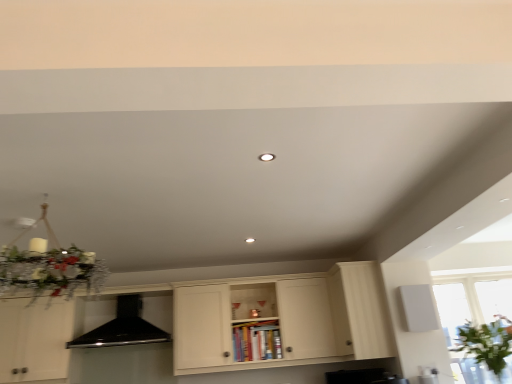
Question: From a real-world perspective, is matte white cabinet at center, the 2th cabinetry when ordered from right to left, physically located above or below black matte exhaust hood at center?

Choices:
 (A) above
 (B) below

Answer: (B)

Question: Is matte white cabinet at center, positioned as the 1th cabinetry in left-to-right order, taller or shorter than black matte exhaust hood at center?

Choices:
 (A) short
 (B) tall

Answer: (B)

Question: Estimate the real-world distances between objects in this image. Which object is closer to the transparent glass window at lower right?

Choices:
 (A) white wood cabinet at right, the second cabinetry positioned from the left
 (B) matte white cabinet at center, the 2th cabinetry when ordered from right to left
 (C) black matte exhaust hood at center

Answer: (A)

Question: Estimate the real-world distances between objects in this image. Which object is closer to the white wood cabinet at right, the second cabinetry positioned from the left?

Choices:
 (A) transparent glass window at lower right
 (B) black matte exhaust hood at center
 (C) matte white cabinet at center, the 2th cabinetry when ordered from right to left

Answer: (C)